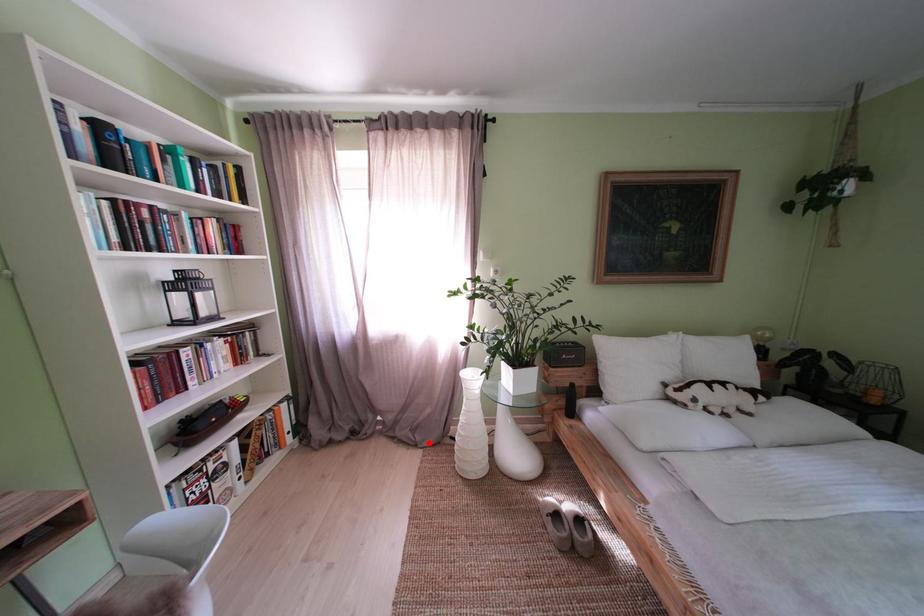
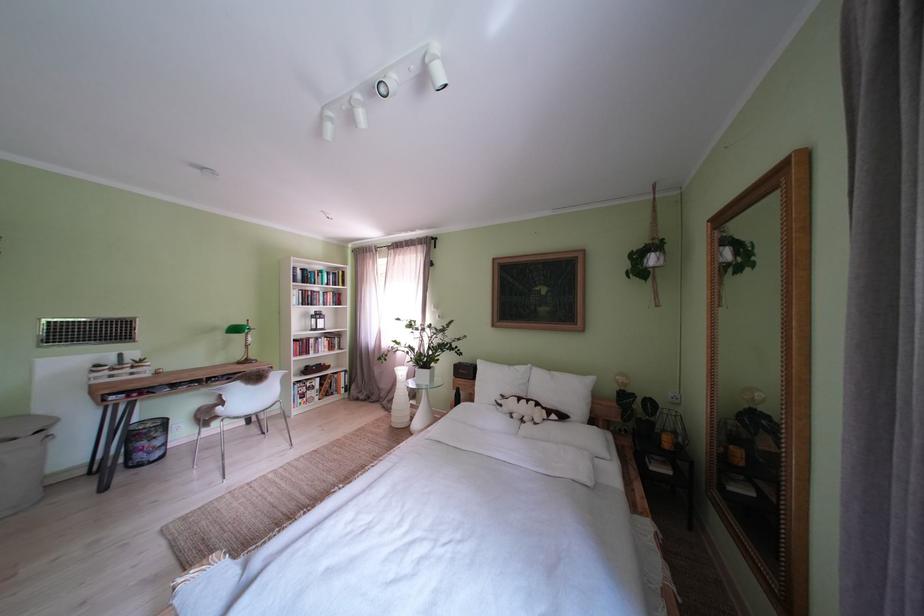
Where in the second image is the point corresponding to the highlighted location from the first image?

(400, 411)